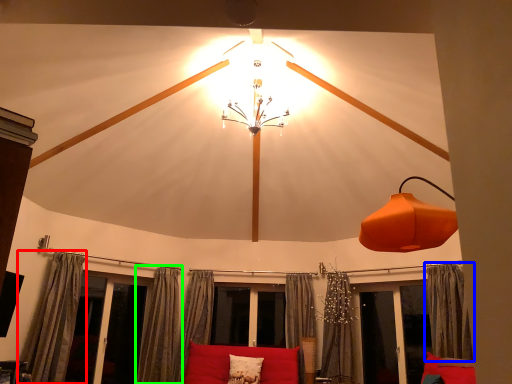
Question: Based on their relative distances, which object is nearer to curtain (highlighted by a red box)? Choose from curtain (highlighted by a blue box) and curtain (highlighted by a green box).

Choices:
 (A) curtain
 (B) curtain

Answer: (B)